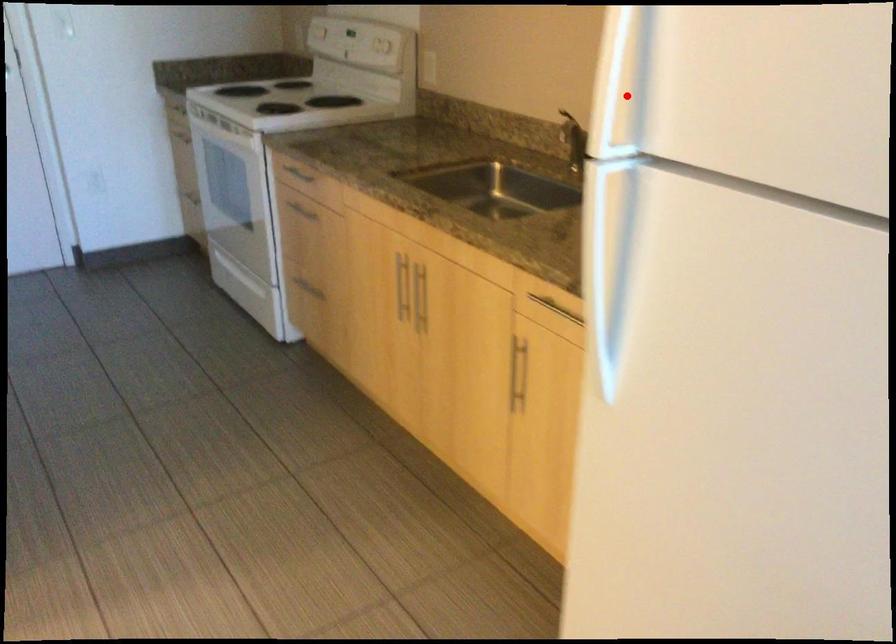
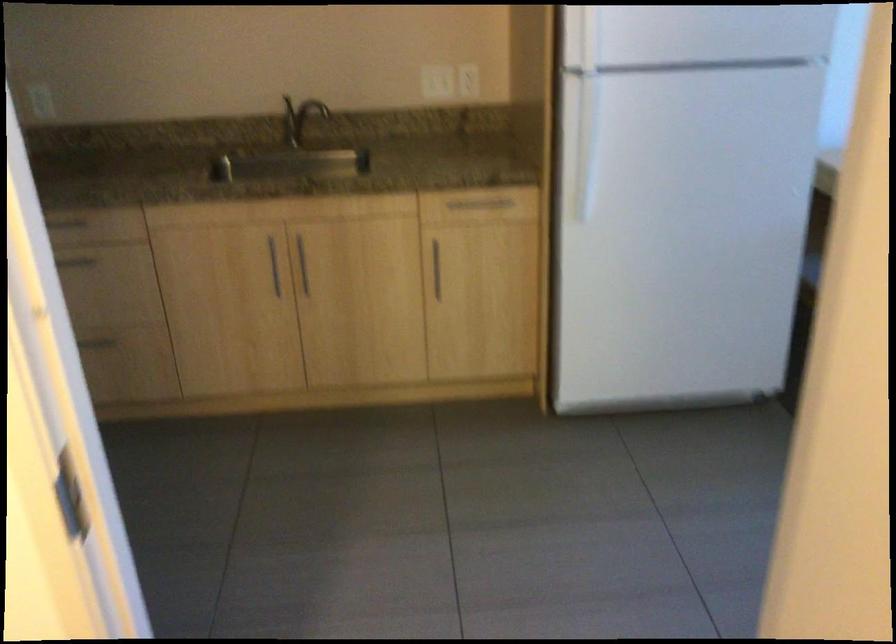
Question: I am providing you with two images of the same scene from different viewpoints. A red point is shown in image1. For the corresponding object point in image2, is it positioned nearer or farther from the camera?

Choices:
 (A) Nearer
 (B) Farther

Answer: (B)